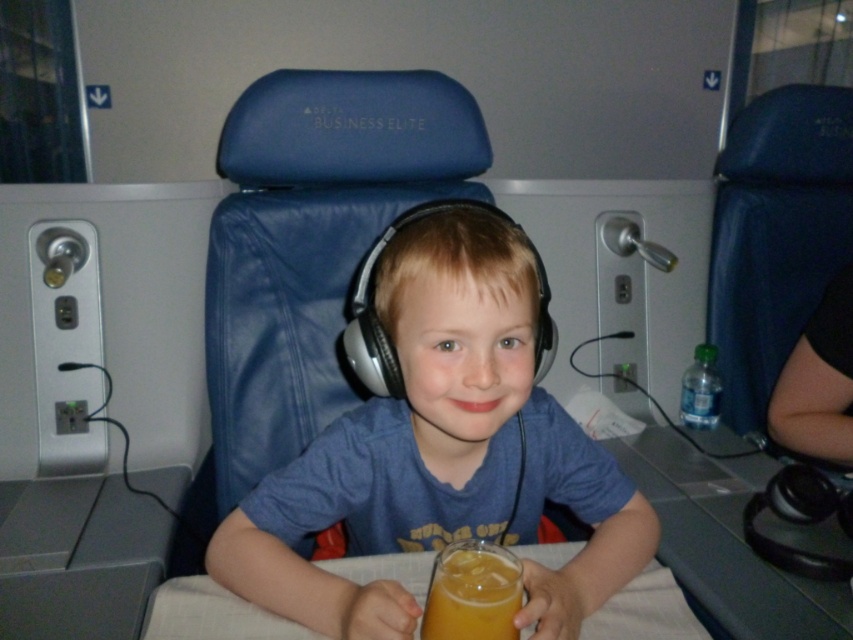
Question: Which point is farther to the camera?

Choices:
 (A) translucent glass at center
 (B) white fabric table at center

Answer: (B)

Question: Is white fabric table at center above translucent glass at center?

Choices:
 (A) no
 (B) yes

Answer: (A)

Question: Which point is closer to the camera?

Choices:
 (A) clear plastic bottle at lower right
 (B) matte blue headphones at center
 (C) translucent glass at center

Answer: (C)

Question: Which is farther from the clear plastic bottle at lower right?

Choices:
 (A) matte blue headphones at center
 (B) translucent glass at center

Answer: (B)

Question: Is white fabric table at center below translucent glass at center?

Choices:
 (A) no
 (B) yes

Answer: (B)

Question: Can you confirm if matte blue headphones at center is bigger than translucent glass at center?

Choices:
 (A) yes
 (B) no

Answer: (A)